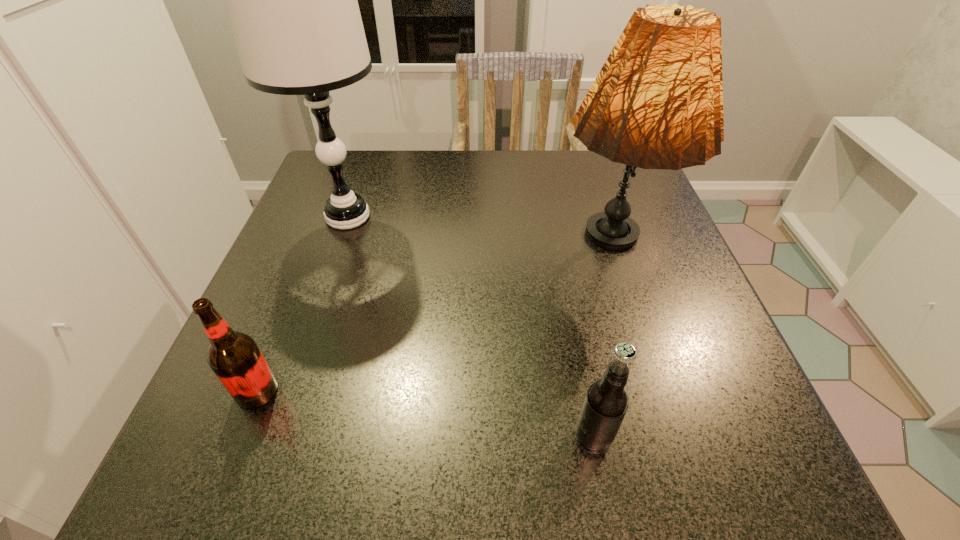
You are a GUI agent. You are given a task and a screenshot of the screen. Output one action in this format:
    pyautogui.click(x=<x>, y=<y>)
    Task: Click on the vacant space that satisfies the following two spatial constraints: 1. on the back side of the table lamp; 2. on the right side of the second nearest object
    
    Given the screenshot: What is the action you would take?
    click(x=327, y=217)